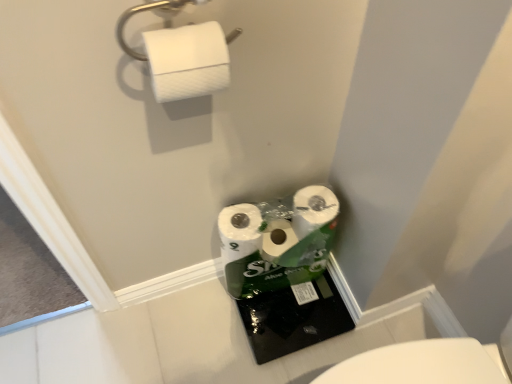
Identify the location of white textured toilet paper at upper left. The height and width of the screenshot is (384, 512). (187, 61).

Describe the element at coordinates (187, 61) in the screenshot. Image resolution: width=512 pixels, height=384 pixels. I see `white textured toilet paper at upper left` at that location.

Where is `white matte paper towel at upper left`? white matte paper towel at upper left is located at coordinates (139, 12).

What do you see at coordinates (139, 12) in the screenshot? This screenshot has width=512, height=384. I see `white matte paper towel at upper left` at bounding box center [139, 12].

At what (x,y) coordinates should I click in order to perform the action: click on white textured toilet paper at upper left. Please return your answer as a coordinate pair (x, y). Looking at the image, I should click on (187, 61).

Is white matte paper towel at upper left at the right side of white textured toilet paper at upper left?

Incorrect, white matte paper towel at upper left is not on the right side of white textured toilet paper at upper left.

Considering the relative positions of white matte paper towel at upper left and white textured toilet paper at upper left in the image provided, is white matte paper towel at upper left behind white textured toilet paper at upper left?

No, white matte paper towel at upper left is closer to the viewer.

Which is farther from the camera, (124, 45) or (198, 56)?

The point (124, 45) is farther.

From the image's perspective, which one is positioned higher, white matte paper towel at upper left or white textured toilet paper at upper left?

white matte paper towel at upper left.

From a real-world perspective, is white matte paper towel at upper left physically located above or below white textured toilet paper at upper left?

From a real-world perspective, white matte paper towel at upper left is physically above white textured toilet paper at upper left.

Can you confirm if white matte paper towel at upper left is thinner than white textured toilet paper at upper left?

Yes.

Considering the sizes of objects white matte paper towel at upper left and white textured toilet paper at upper left in the image provided, who is shorter, white matte paper towel at upper left or white textured toilet paper at upper left?

With less height is white textured toilet paper at upper left.

Considering the sizes of objects white matte paper towel at upper left and white textured toilet paper at upper left in the image provided, who is bigger, white matte paper towel at upper left or white textured toilet paper at upper left?

white textured toilet paper at upper left.

Do you think white matte paper towel at upper left is within white textured toilet paper at upper left, or outside of it?

white matte paper towel at upper left lies outside white textured toilet paper at upper left.

Are white matte paper towel at upper left and white textured toilet paper at upper left far apart?

No, white matte paper towel at upper left is not far away from white textured toilet paper at upper left.

Is white matte paper towel at upper left aimed at white textured toilet paper at upper left?

No, white matte paper towel at upper left is not oriented towards white textured toilet paper at upper left.

The image size is (512, 384). In order to click on toilet paper behind the white matte paper towel at upper left in this screenshot , I will do `click(187, 61)`.

Which is more to the right, white textured toilet paper at upper left or white matte paper towel at upper left?

white textured toilet paper at upper left is more to the right.

Considering their positions, is white textured toilet paper at upper left located in front of or behind white matte paper towel at upper left?

In the image, white textured toilet paper at upper left appears behind white matte paper towel at upper left.

Which is in front, point (220, 61) or point (122, 26)?

Positioned in front is point (122, 26).

From the image's perspective, is white textured toilet paper at upper left above or below white matte paper towel at upper left?

white textured toilet paper at upper left is below white matte paper towel at upper left.

From a real-world perspective, which is physically above, white textured toilet paper at upper left or white matte paper towel at upper left?

white matte paper towel at upper left.

Which object is wider, white textured toilet paper at upper left or white matte paper towel at upper left?

Wider between the two is white textured toilet paper at upper left.

Can you confirm if white textured toilet paper at upper left is taller than white matte paper towel at upper left?

No, white textured toilet paper at upper left is not taller than white matte paper towel at upper left.

Considering the relative sizes of white textured toilet paper at upper left and white matte paper towel at upper left in the image provided, is white textured toilet paper at upper left smaller than white matte paper towel at upper left?

No.

Is white textured toilet paper at upper left outside of white matte paper towel at upper left?

Indeed, white textured toilet paper at upper left is completely outside white matte paper towel at upper left.

Is white textured toilet paper at upper left directly adjacent to white matte paper towel at upper left?

Yes, the surface of white textured toilet paper at upper left is in contact with white matte paper towel at upper left.

Is white textured toilet paper at upper left facing towards white matte paper towel at upper left?

No.

What's the angular difference between white textured toilet paper at upper left and white matte paper towel at upper left's facing directions?

The facing directions of white textured toilet paper at upper left and white matte paper towel at upper left are 1.91 degrees apart.

How far apart are white textured toilet paper at upper left and white matte paper towel at upper left?

white textured toilet paper at upper left and white matte paper towel at upper left are 2.22 inches apart from each other.

Image resolution: width=512 pixels, height=384 pixels. There is a white textured toilet paper at upper left. Identify the location of towel bar above it (from a real-world perspective). (139, 12).

Find the location of a particular element. This screenshot has height=384, width=512. toilet paper below the white matte paper towel at upper left (from the image's perspective) is located at coordinates (187, 61).

Locate an element on the screen. This screenshot has width=512, height=384. towel bar above the white textured toilet paper at upper left (from a real-world perspective) is located at coordinates (139, 12).